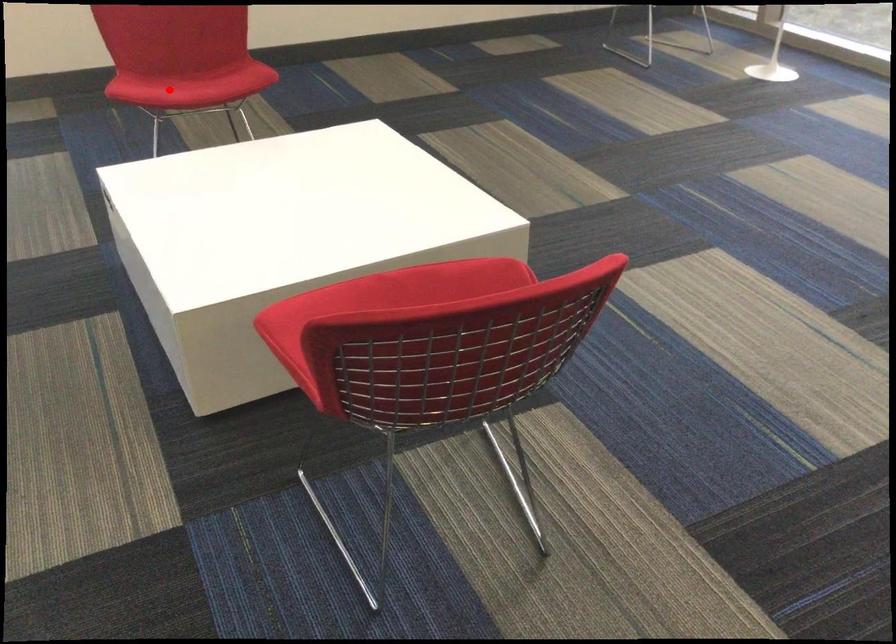
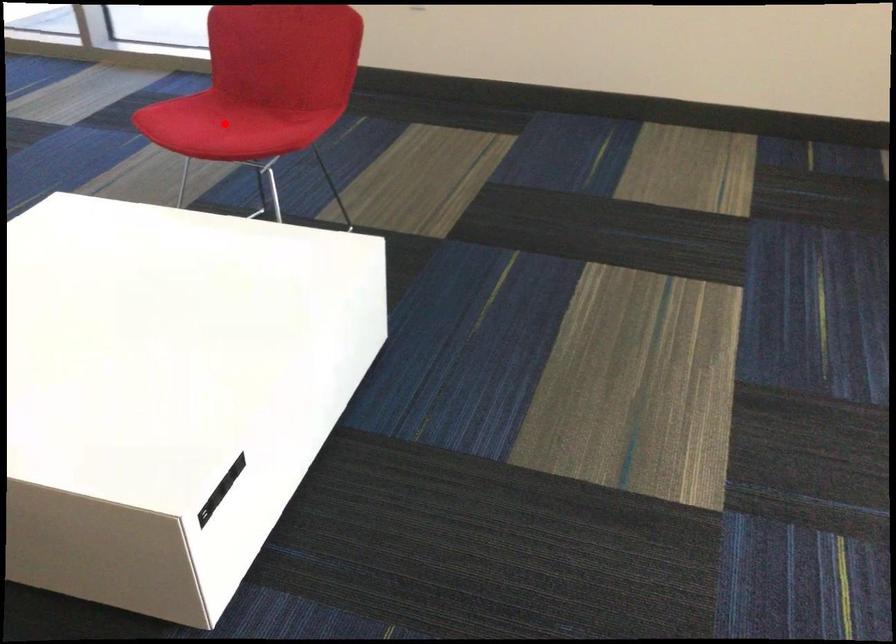
I am providing you with two images of the same scene from different viewpoints. A red point is marked on the first image and another point is marked on the second image. Is the marked point in image1 the same physical position as the marked point in image2?

Yes